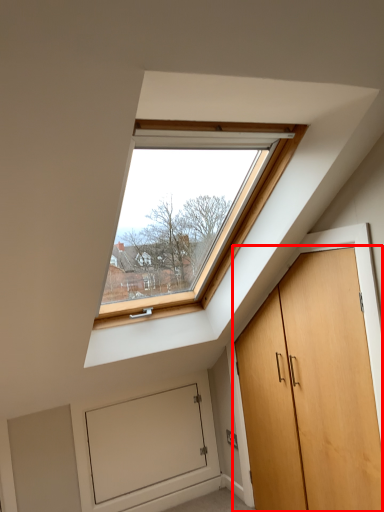
Question: From the image's perspective, considering the relative positions of door (annotated by the red box) and garage door in the image provided, where is door (annotated by the red box) located with respect to the staircase?

Choices:
 (A) above
 (B) below

Answer: (A)